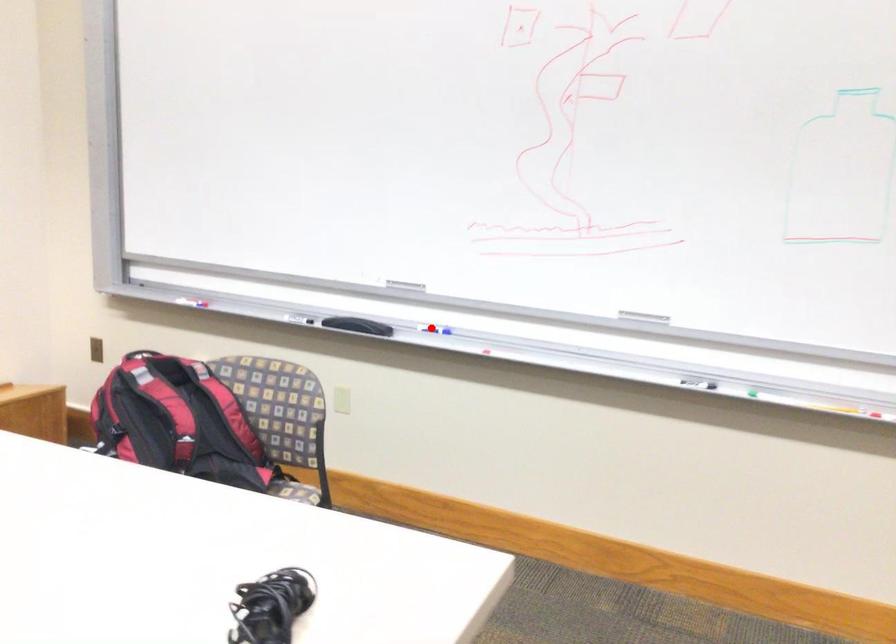
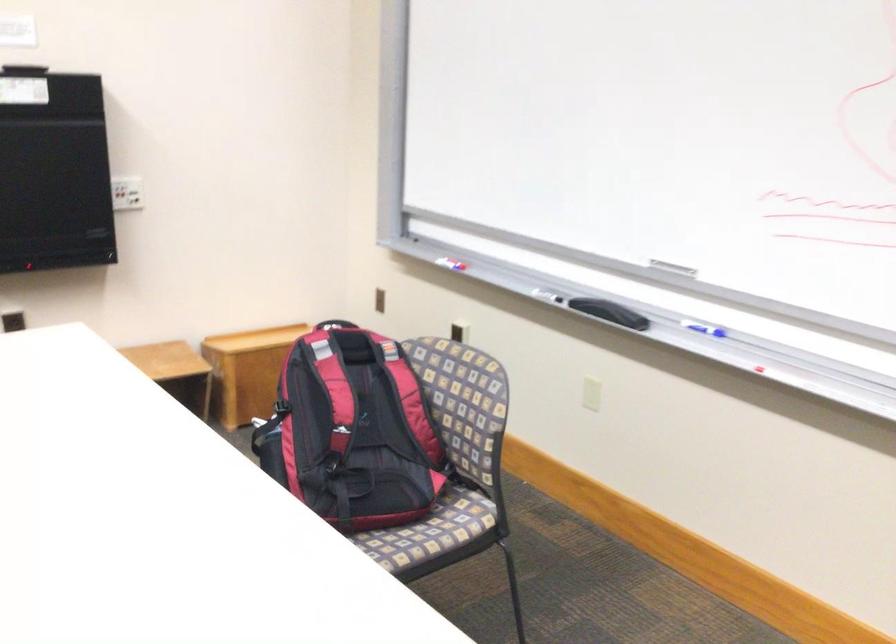
Question: I am providing you with two images of the same scene from different viewpoints. A red point is marked on the first image. Is the red point's position out of view in image 2?

Choices:
 (A) Yes
 (B) No

Answer: (B)